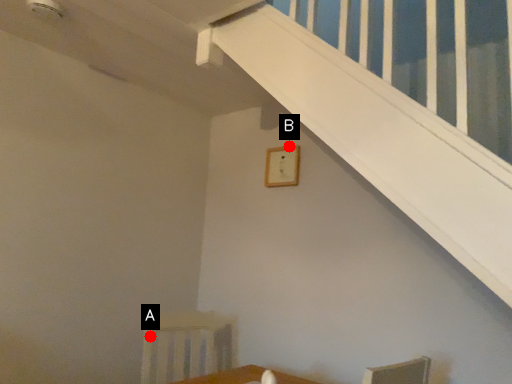
Question: Two points are circled on the image, labeled by A and B beside each circle. Which point appears farthest from the camera in this image?

Choices:
 (A) A is further
 (B) B is further

Answer: (B)